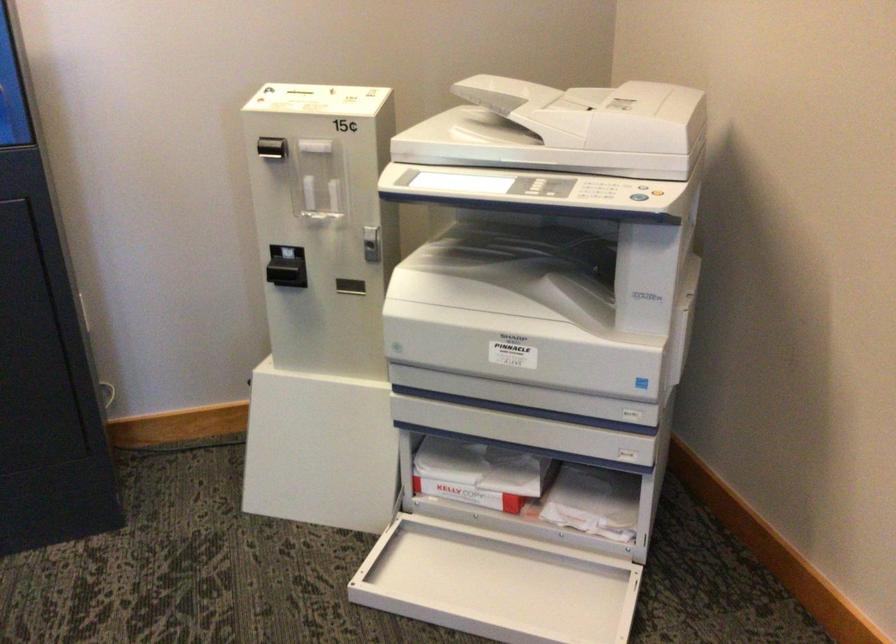
The location [469,495] corresponds to which object?

It corresponds to the red paper package in the image.